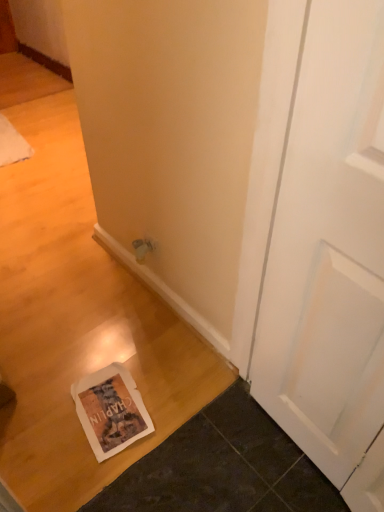
At what (x,y) coordinates should I click in order to perform the action: click on vacant region to the left of white matte door at center. Please return your answer as a coordinate pair (x, y). The image size is (384, 512). Looking at the image, I should click on (217, 449).